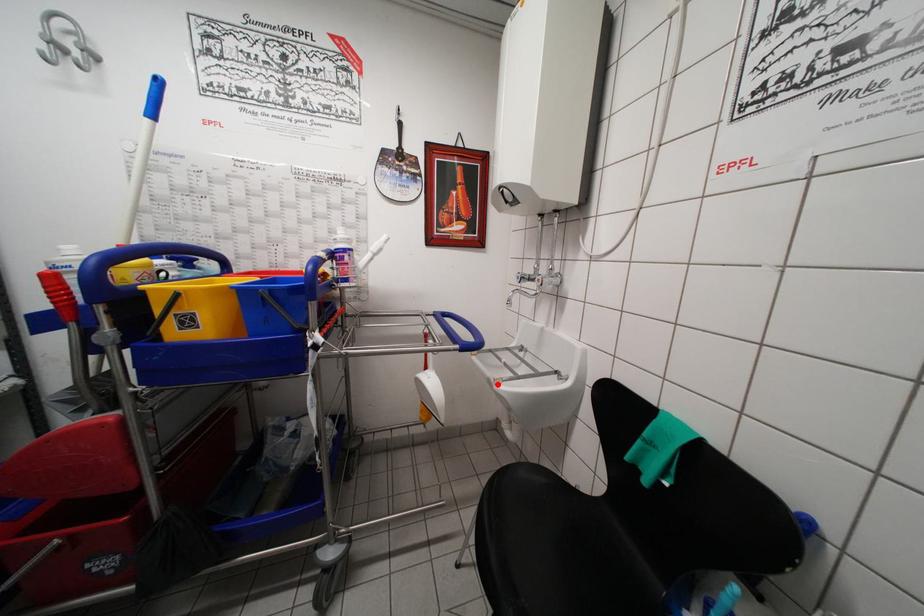
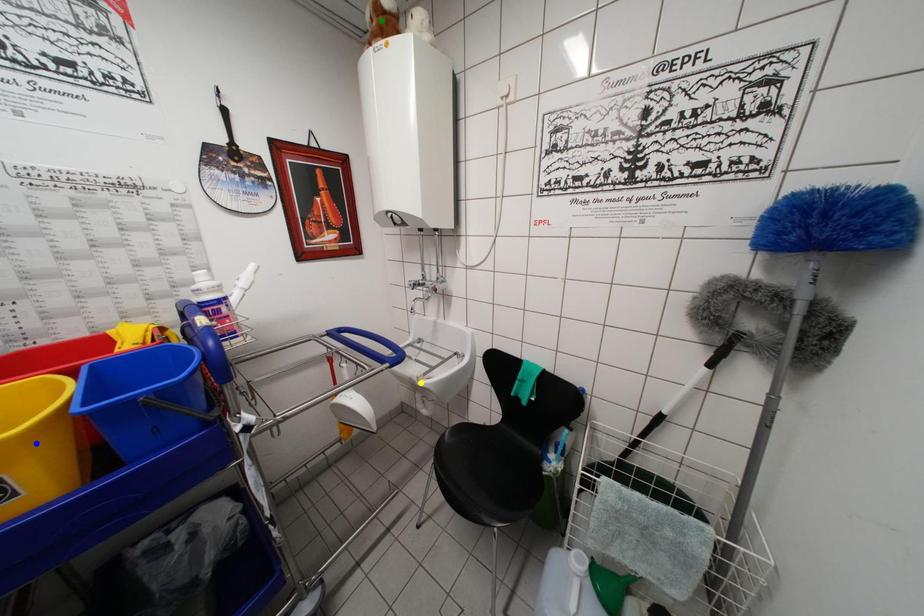
Question: I am providing you with two images of the same scene from different viewpoints. A red point is marked on the first image. You are given multiple points on the second image. In image 2, which mark is for the same physical point as the one in image 1?

Choices:
 (A) green point
 (B) yellow point
 (C) blue point

Answer: (B)